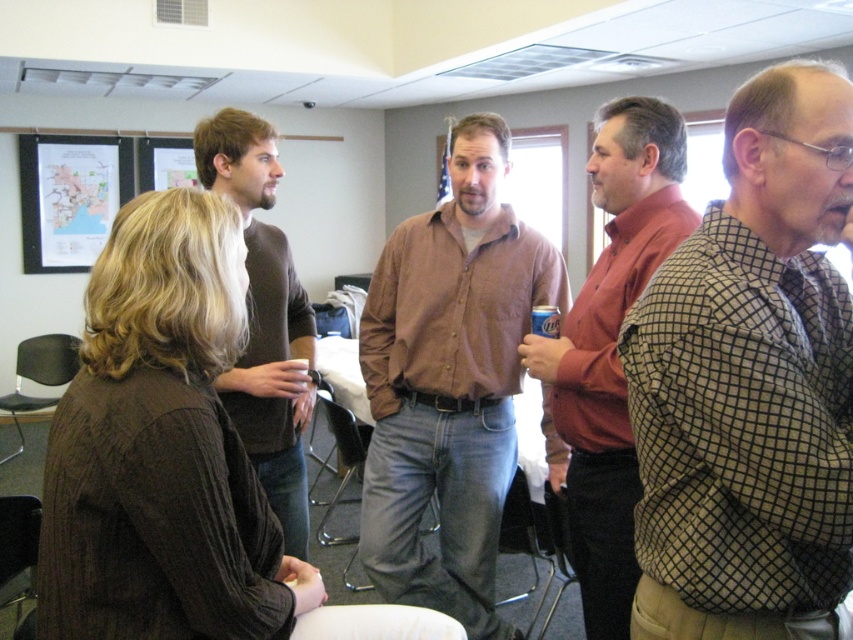
Question: Which point is closer to the camera taking this photo?

Choices:
 (A) (439, 564)
 (B) (286, 300)

Answer: (B)

Question: Does matte brown shirt at center have a larger size compared to dark brown sweater at center?

Choices:
 (A) no
 (B) yes

Answer: (B)

Question: Based on their relative distances, which object is farther from the checkered fabric shirt at right?

Choices:
 (A) brown shirt at center
 (B) dark brown sweater at center

Answer: (B)

Question: Estimate the real-world distances between objects in this image. Which object is farther from the matte brown shirt at center?

Choices:
 (A) dark brown sweater at center
 (B) checkered fabric shirt at right

Answer: (A)

Question: Does checkered fabric shirt at right have a larger size compared to brown shirt at center?

Choices:
 (A) yes
 (B) no

Answer: (B)

Question: Does checkered fabric shirt at right appear on the right side of dark brown sweater at center?

Choices:
 (A) yes
 (B) no

Answer: (A)